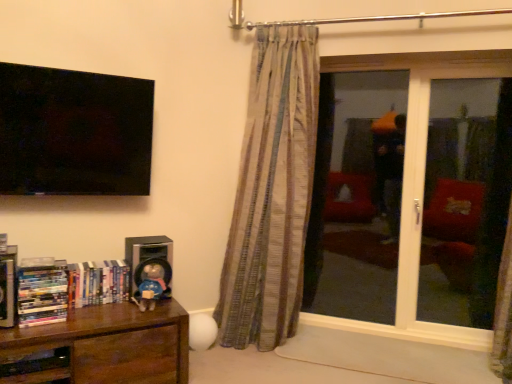
Question: From the image's perspective, is brown wood bookcase at lower left above or below hardcover book at left, the 3th book viewed from the right?

Choices:
 (A) above
 (B) below

Answer: (B)

Question: Would you say brown wood bookcase at lower left is to the left or to the right of hardcover book at left, positioned as the first book in left-to-right order, in the picture?

Choices:
 (A) right
 (B) left

Answer: (A)

Question: Which is nearer to the matte blue plush at lower left?

Choices:
 (A) transparent glass door at right
 (B) transparent glass screen door at right, the second screen door viewed from the left
 (C) multicolored plastic books at lower left, which appears as the 2th book when viewed from the left
 (D) hardcover book at left, positioned as the first book in left-to-right order
 (E) brown wood bookcase at lower left

Answer: (E)

Question: Estimate the real-world distances between objects in this image. Which object is farther from the hardcover books at left, the 1th book viewed from the right?

Choices:
 (A) hardcover book at left, positioned as the first book in left-to-right order
 (B) clear glass screen door at center, placed as the 1th screen door when sorted from left to right
 (C) satin black speaker at lower left
 (D) transparent glass screen door at right, the second screen door viewed from the left
 (E) multicolored plastic books at lower left, the second book in the right-to-left sequence

Answer: (D)